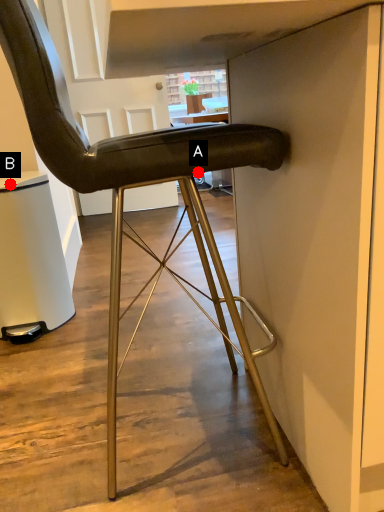
Question: Two points are circled on the image, labeled by A and B beside each circle. Which point is closer to the camera taking this photo?

Choices:
 (A) A is closer
 (B) B is closer

Answer: (A)